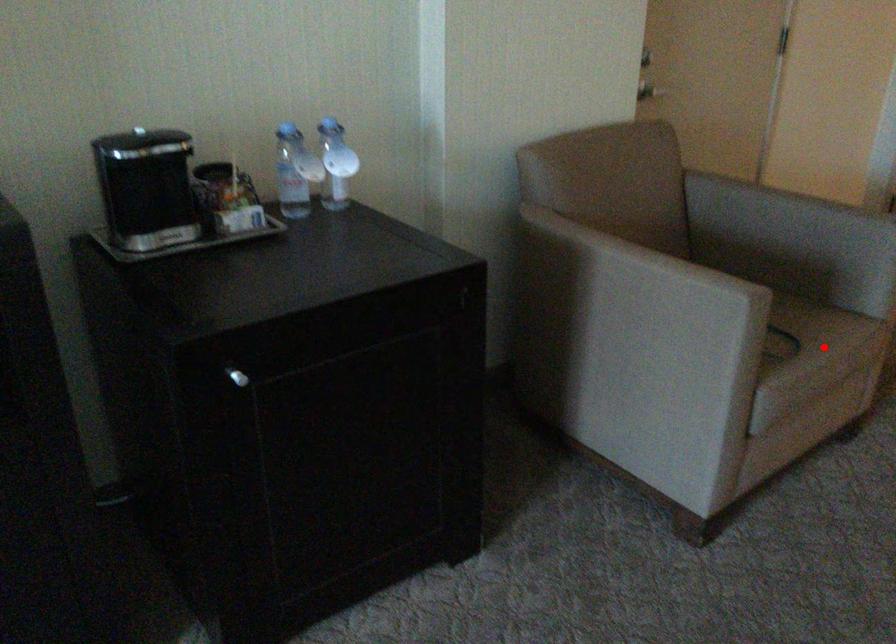
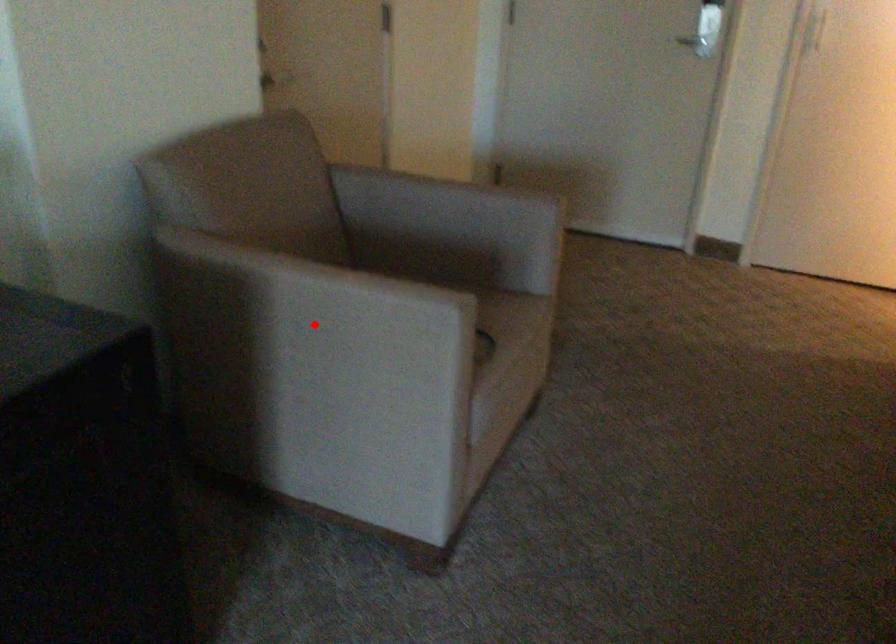
I am providing you with two images of the same scene from different viewpoints. A red point is marked on the first image and another point is marked on the second image. Do the highlighted points in image1 and image2 indicate the same real-world spot?

No